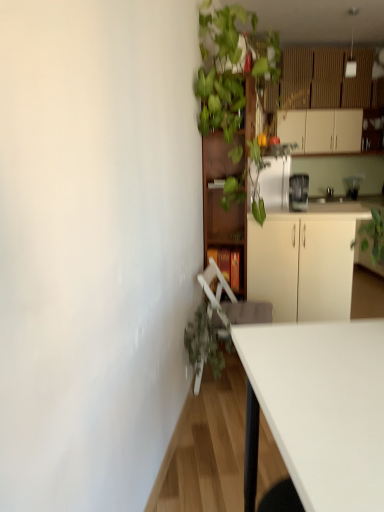
Question: From the image's perspective, is white matte cabinet at center, the first cabinetry when ordered from front to back, on green leafy plant at upper center?

Choices:
 (A) yes
 (B) no

Answer: (B)

Question: Is white matte cabinet at center, which is the 2th cabinetry in left-to-right order, taller than green leafy plant at upper center?

Choices:
 (A) no
 (B) yes

Answer: (A)

Question: From the image's perspective, is white matte cabinet at center, placed as the second cabinetry when sorted from right to left, under green leafy plant at upper center?

Choices:
 (A) yes
 (B) no

Answer: (A)

Question: From a real-world perspective, does white matte cabinet at center, acting as the 3th cabinetry starting from the back, stand above green leafy plant at upper center?

Choices:
 (A) yes
 (B) no

Answer: (B)

Question: Is white matte cabinet at center, which is the 2th cabinetry in bottom-to-top order, bigger than green leafy plant at upper center?

Choices:
 (A) no
 (B) yes

Answer: (A)

Question: From the image's perspective, is green leafy plant at upper center positioned above or below green matte plant at lower left?

Choices:
 (A) below
 (B) above

Answer: (B)

Question: Relative to green matte plant at lower left, is green leafy plant at upper center in front or behind?

Choices:
 (A) front
 (B) behind

Answer: (B)

Question: Is point (221, 199) positioned closer to the camera than point (193, 348)?

Choices:
 (A) closer
 (B) farther

Answer: (B)

Question: Based on their positions, is green leafy plant at upper center located to the left or right of green matte plant at lower left?

Choices:
 (A) right
 (B) left

Answer: (A)

Question: From the image's perspective, is brown wooden bookshelf at center, which appears as the 3th cabinetry when viewed from the right, positioned above or below clear glass blender at upper right, the second appliance positioned from the left?

Choices:
 (A) below
 (B) above

Answer: (A)

Question: Is brown wooden bookshelf at center, which appears as the 3th cabinetry when viewed from the right, in front of or behind clear glass blender at upper right, the second appliance positioned from the left, in the image?

Choices:
 (A) front
 (B) behind

Answer: (A)

Question: In terms of size, does brown wooden bookshelf at center, which appears as the 3th cabinetry when viewed from the right, appear bigger or smaller than clear glass blender at upper right, which is counted as the second appliance, starting from the front?

Choices:
 (A) small
 (B) big

Answer: (B)

Question: From a real-world perspective, is brown wooden bookshelf at center, arranged as the first cabinetry when viewed from the left, physically located above or below clear glass blender at upper right, which ranks as the 1th appliance in right-to-left order?

Choices:
 (A) above
 (B) below

Answer: (B)

Question: Considering the relative positions of satin silver blender at upper right, positioned as the second appliance in back-to-front order, and brown wooden bookshelf at center, positioned as the second cabinetry in back-to-front order, in the image provided, is satin silver blender at upper right, positioned as the second appliance in back-to-front order, to the left or to the right of brown wooden bookshelf at center, positioned as the second cabinetry in back-to-front order,?

Choices:
 (A) left
 (B) right

Answer: (B)

Question: Is point (289, 181) positioned closer to the camera than point (215, 259)?

Choices:
 (A) closer
 (B) farther

Answer: (B)